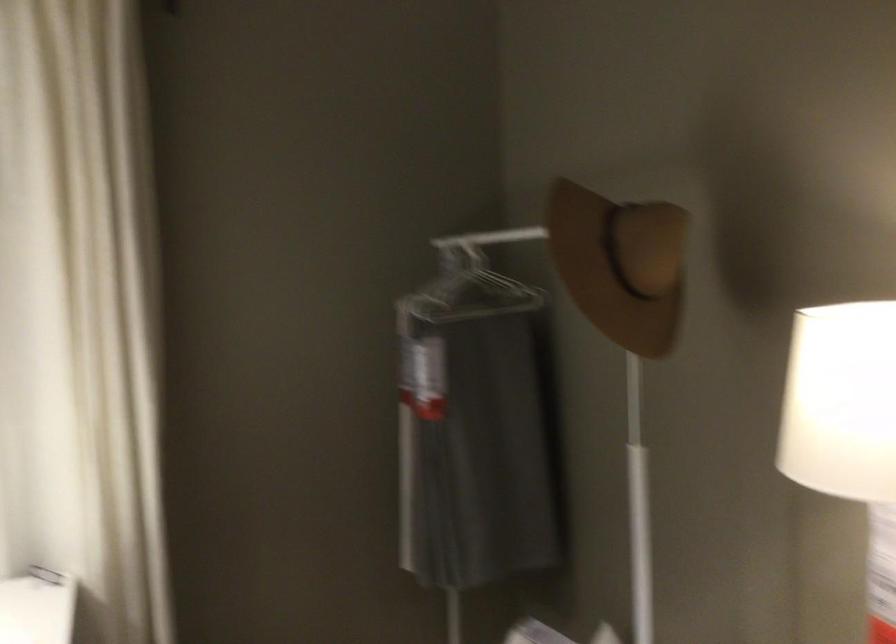
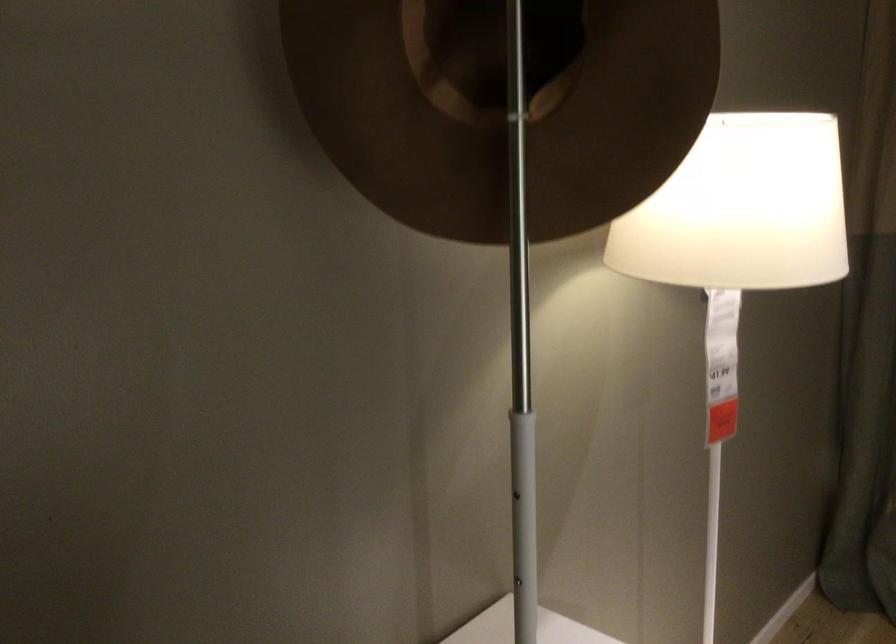
In the second image, find the point that corresponds to point (639, 527) in the first image.

(522, 553)